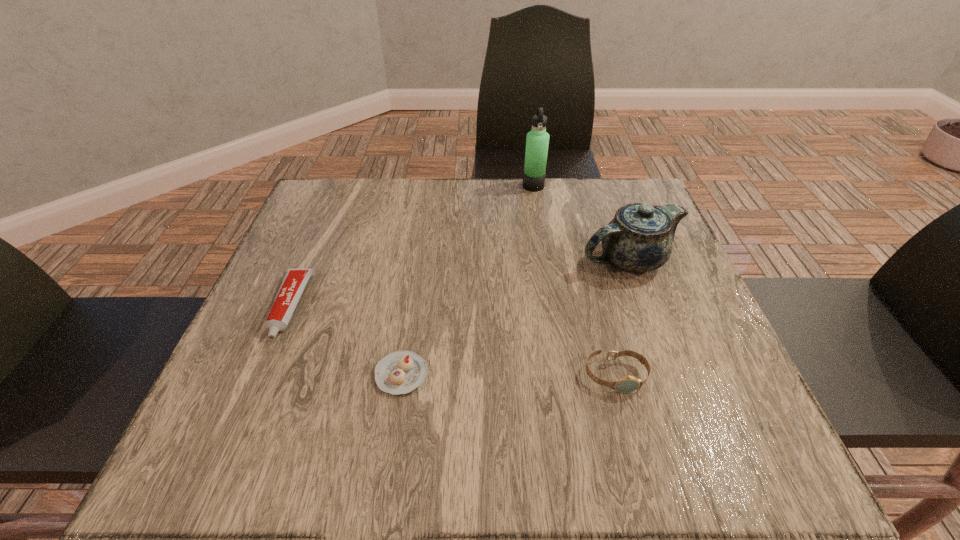
Locate an element on the screen. This screenshot has width=960, height=540. free space at the right edge of the desktop is located at coordinates tap(656, 362).

This screenshot has width=960, height=540. Find the location of `free space at the far left corner`. free space at the far left corner is located at coordinates (307, 208).

Image resolution: width=960 pixels, height=540 pixels. What are the coordinates of `vacant area at the far right corner` in the screenshot? It's located at (617, 199).

This screenshot has height=540, width=960. What are the coordinates of `free space between the second object from left to right and the watch` in the screenshot? It's located at (509, 375).

The width and height of the screenshot is (960, 540). Find the location of `empty space between the toothpaste and the fourth shortest object`. empty space between the toothpaste and the fourth shortest object is located at coordinates (459, 284).

Where is `free area in between the tallest object and the cupcake`? This screenshot has height=540, width=960. free area in between the tallest object and the cupcake is located at coordinates (468, 280).

Where is `blank region between the fourth shortest object and the cupcake`? The width and height of the screenshot is (960, 540). blank region between the fourth shortest object and the cupcake is located at coordinates (515, 317).

The width and height of the screenshot is (960, 540). In order to click on free spot between the watch and the fourth object from right to left in this screenshot , I will do `click(509, 375)`.

You are a GUI agent. You are given a task and a screenshot of the screen. Output one action in this format:
    pyautogui.click(x=<x>, y=<y>)
    Task: Click on the blank region between the third tallest object and the fourth object from right to left
    The image size is (960, 540).
    Given the screenshot: What is the action you would take?
    pyautogui.click(x=509, y=375)

This screenshot has height=540, width=960. Identify the location of vacant area that lies between the tallest object and the leftmost object. (412, 246).